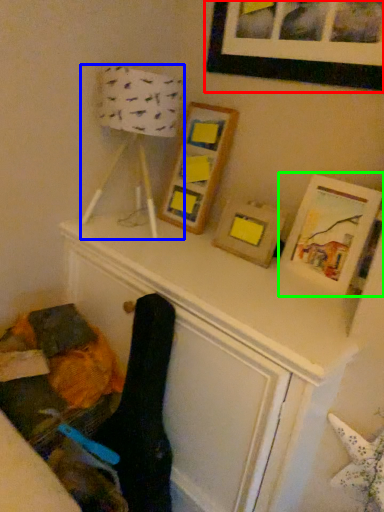
Question: Estimate the real-world distances between objects in this image. Which object is closer to picture frame (highlighted by a red box), table lamp (highlighted by a blue box) or picture frame (highlighted by a green box)?

Choices:
 (A) table lamp
 (B) picture frame

Answer: (A)